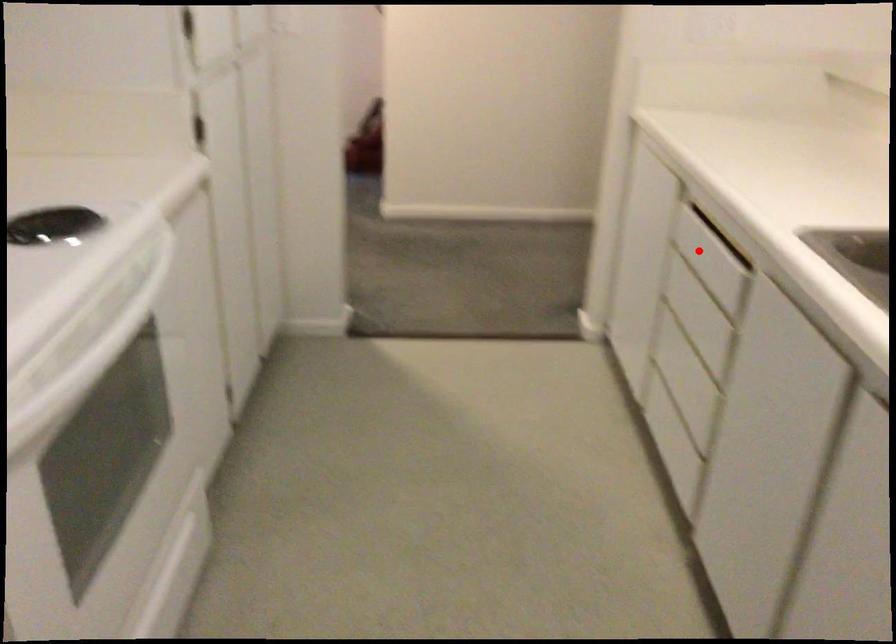
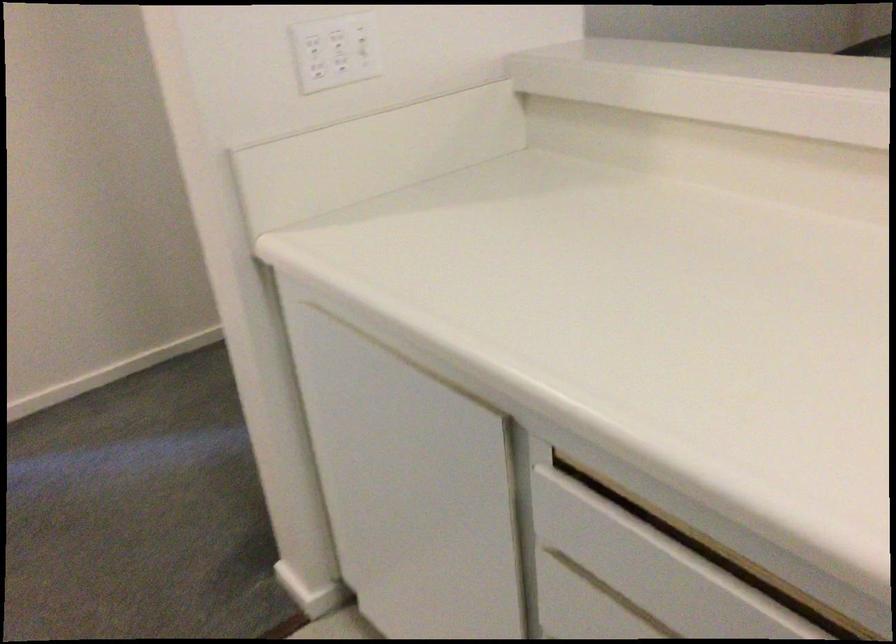
Question: A red point is marked in image1. In image2, is the corresponding 3D point closer to the camera or farther? Reply with the corresponding letter.

Choices:
 (A) The corresponding 3D point is closer.
 (B) The corresponding 3D point is farther.

Answer: (A)